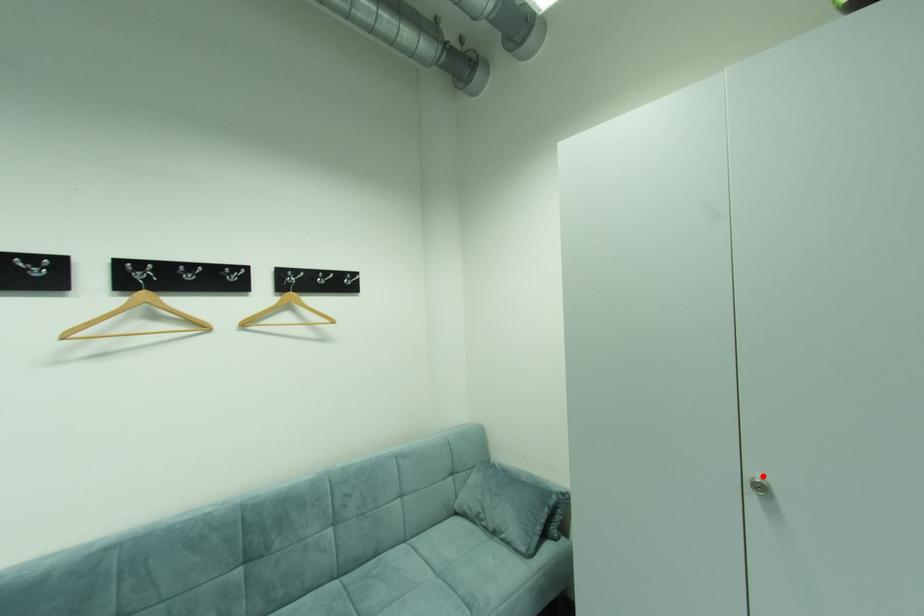
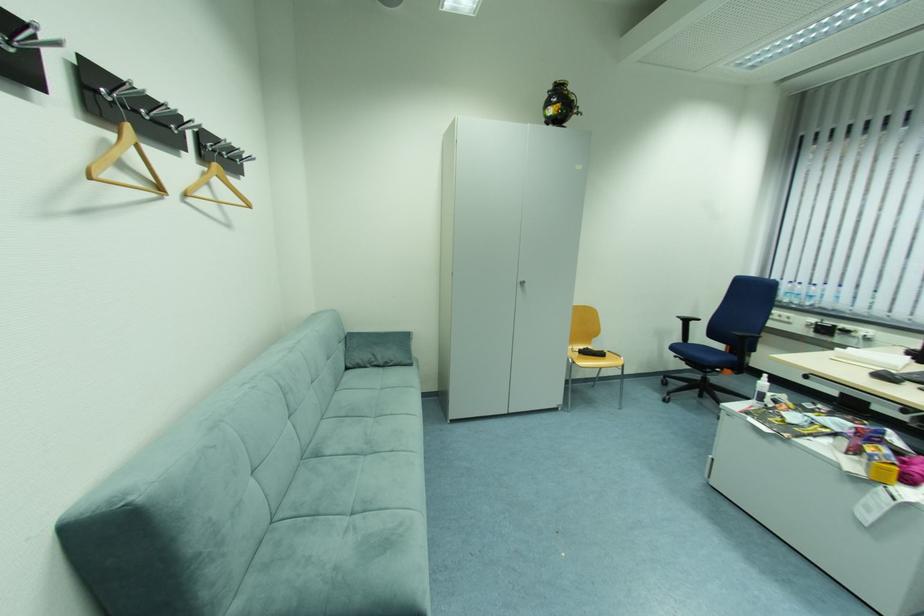
Where in the second image is the point corresponding to the highlighted location from the first image?

(527, 281)